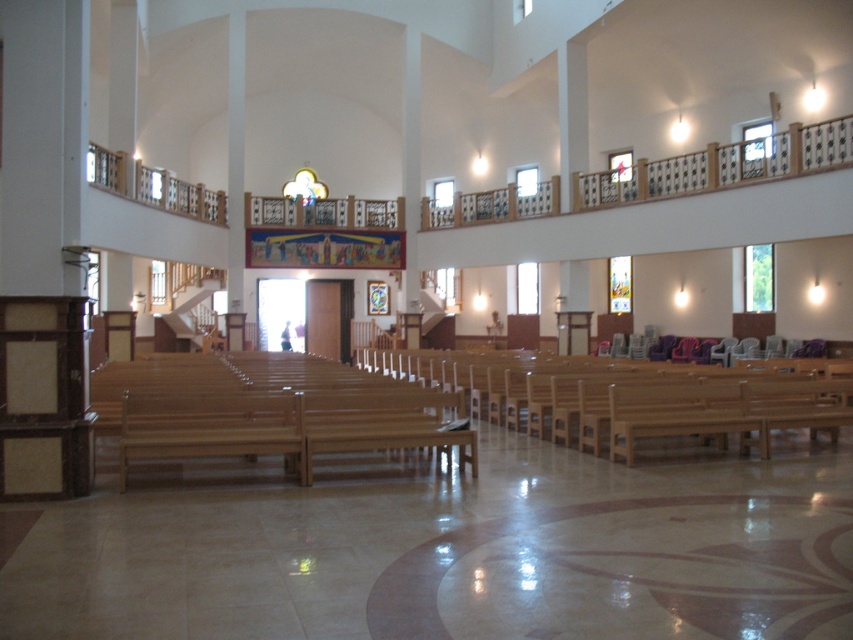
Question: Is wooden at center above wooden church bench at center?

Choices:
 (A) yes
 (B) no

Answer: (B)

Question: Which point appears closest to the camera in this image?

Choices:
 (A) (300, 378)
 (B) (543, 401)

Answer: (B)

Question: Among these points, which one is farthest from the camera?

Choices:
 (A) (807, 362)
 (B) (302, 401)

Answer: (A)

Question: Can you confirm if wooden at center is positioned above wooden church bench at center?

Choices:
 (A) yes
 (B) no

Answer: (B)

Question: Is wooden at center wider than wooden church bench at center?

Choices:
 (A) no
 (B) yes

Answer: (A)